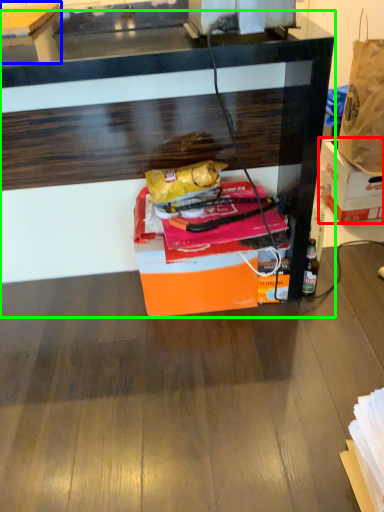
Question: Which is nearer to the box (highlighted by a red box)? table (highlighted by a blue box) or desk (highlighted by a green box).

Choices:
 (A) table
 (B) desk

Answer: (B)